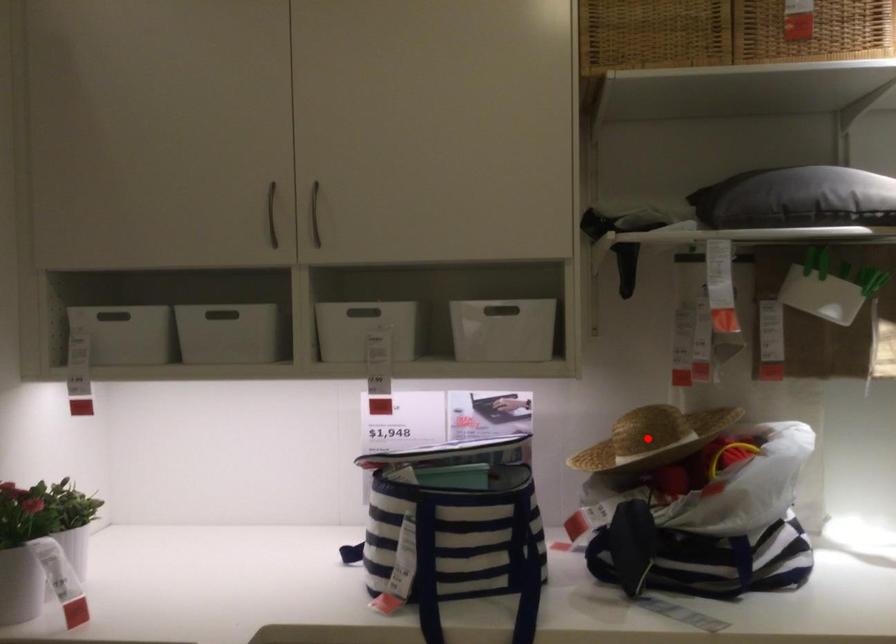
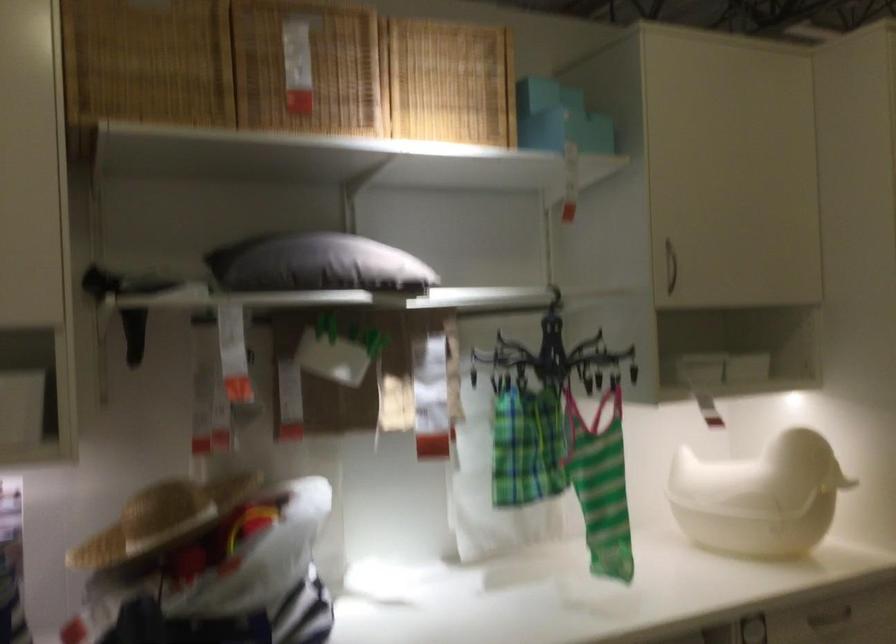
Locate, in the second image, the point that corresponds to the highlighted location in the first image.

(161, 520)